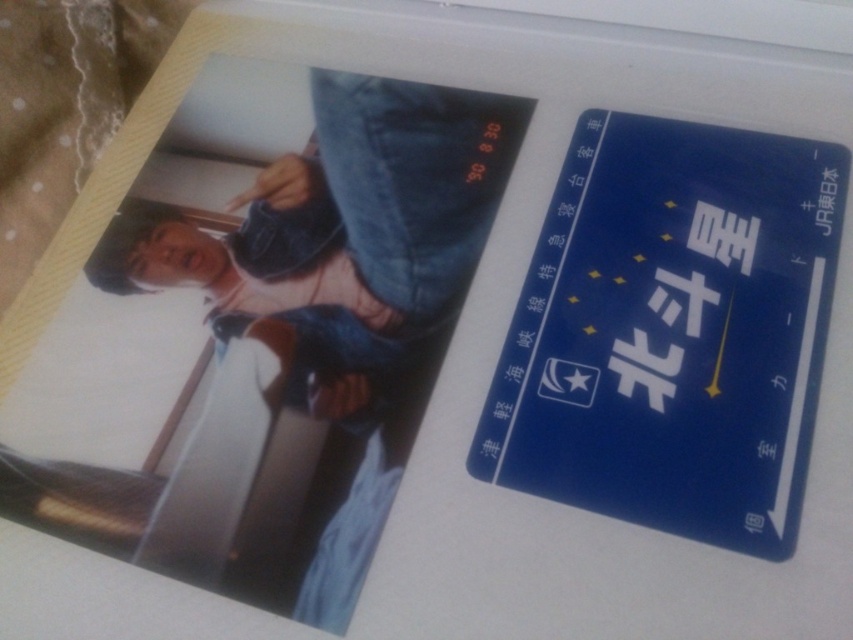
Is point (614, 339) positioned before point (461, 141)?

Yes, point (614, 339) is in front of point (461, 141).

Who is more forward, (788, 342) or (485, 212)?

Point (788, 342)

The height and width of the screenshot is (640, 853). I want to click on blue card at upper right, so click(672, 330).